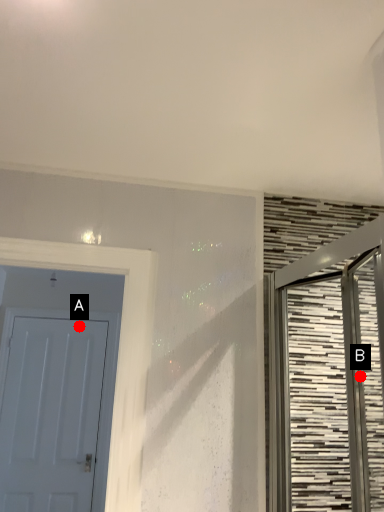
Question: Two points are circled on the image, labeled by A and B beside each circle. Which of the following is the closest to the observer?

Choices:
 (A) A is closer
 (B) B is closer

Answer: (B)